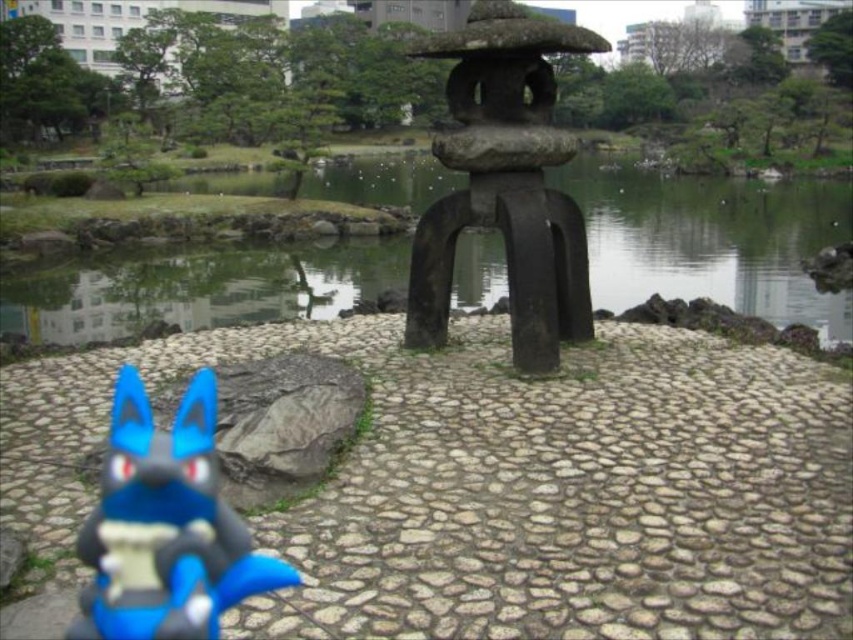
Question: Based on their relative distances, which object is farther from the blue matte plush toy at lower left?

Choices:
 (A) dark gray stone lantern at center
 (B) green stone lake at center

Answer: (B)

Question: Can you confirm if green stone lake at center is bigger than blue matte plush toy at lower left?

Choices:
 (A) yes
 (B) no

Answer: (A)

Question: Can you confirm if dark gray stone lantern at center is smaller than blue matte plush toy at lower left?

Choices:
 (A) no
 (B) yes

Answer: (A)

Question: Is dark gray stone lantern at center smaller than blue matte plush toy at lower left?

Choices:
 (A) yes
 (B) no

Answer: (B)

Question: Which point is closer to the camera taking this photo?

Choices:
 (A) (343, 272)
 (B) (547, 22)

Answer: (B)

Question: Based on their relative distances, which object is nearer to the blue matte plush toy at lower left?

Choices:
 (A) green stone lake at center
 (B) dark gray stone lantern at center

Answer: (B)